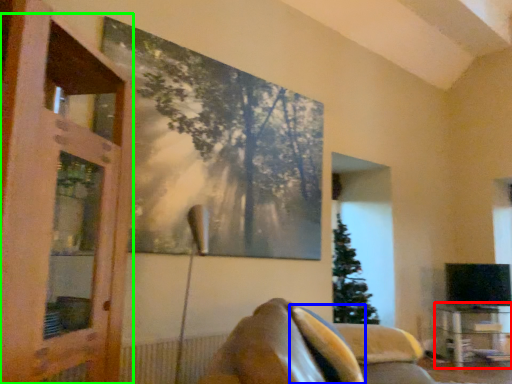
Question: Which object is positioned farthest from table (highlighted by a red box)? Select from pillow (highlighted by a blue box) and screen door (highlighted by a green box).

Choices:
 (A) pillow
 (B) screen door

Answer: (B)